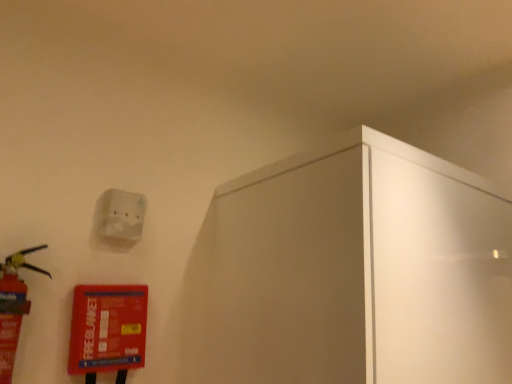
The image size is (512, 384). I want to click on red plastic extinguisher at left, so click(13, 307).

The height and width of the screenshot is (384, 512). Describe the element at coordinates (13, 307) in the screenshot. I see `red plastic extinguisher at left` at that location.

This screenshot has width=512, height=384. I want to click on white matte light switch at upper left, so click(123, 214).

Image resolution: width=512 pixels, height=384 pixels. What do you see at coordinates (123, 214) in the screenshot? I see `white matte light switch at upper left` at bounding box center [123, 214].

Find the location of a particular element. Image resolution: width=512 pixels, height=384 pixels. red plastic extinguisher at left is located at coordinates point(13,307).

Visually, is white matte light switch at upper left positioned to the left or to the right of red plastic extinguisher at left?

white matte light switch at upper left is positioned on red plastic extinguisher at left's right side.

Is the depth of white matte light switch at upper left greater than that of red plastic extinguisher at left?

Yes, white matte light switch at upper left is behind red plastic extinguisher at left.

Which point is more distant from viewer, (x=108, y=233) or (x=18, y=258)?

Point (x=108, y=233)

From the image's perspective, which one is positioned higher, white matte light switch at upper left or red plastic extinguisher at left?

From the image's view, white matte light switch at upper left is above.

From a real-world perspective, which is physically below, white matte light switch at upper left or red plastic extinguisher at left?

red plastic extinguisher at left.

Considering the sizes of white matte light switch at upper left and red plastic extinguisher at left in the image, is white matte light switch at upper left wider or thinner than red plastic extinguisher at left?

Clearly, white matte light switch at upper left has less width compared to red plastic extinguisher at left.

Considering the sizes of objects white matte light switch at upper left and red plastic extinguisher at left in the image provided, who is shorter, white matte light switch at upper left or red plastic extinguisher at left?

white matte light switch at upper left is shorter.

Can you confirm if white matte light switch at upper left is bigger than red plastic extinguisher at left?

Incorrect, white matte light switch at upper left is not larger than red plastic extinguisher at left.

Is white matte light switch at upper left situated inside red plastic extinguisher at left or outside?

white matte light switch at upper left is spatially situated outside red plastic extinguisher at left.

Are white matte light switch at upper left and red plastic extinguisher at left far apart?

No, there isn't a large distance between white matte light switch at upper left and red plastic extinguisher at left.

Is white matte light switch at upper left positioned with its back to red plastic extinguisher at left?

white matte light switch at upper left does not have its back to red plastic extinguisher at left.

How many degrees apart are the facing directions of white matte light switch at upper left and red plastic extinguisher at left?

They differ by 1.39 degrees in their facing directions.

Identify the location of extinguisher located underneath the white matte light switch at upper left (from a real-world perspective). (13, 307).

Can you confirm if red plastic extinguisher at left is positioned to the right of white matte light switch at upper left?

Incorrect, red plastic extinguisher at left is not on the right side of white matte light switch at upper left.

Is the depth of red plastic extinguisher at left greater than that of white matte light switch at upper left?

No, it is not.

Considering the positions of point (8, 333) and point (120, 217), is point (8, 333) closer or farther from the camera than point (120, 217)?

Point (8, 333) is closer to the camera than point (120, 217).

From the image's perspective, is red plastic extinguisher at left positioned above or below white matte light switch at upper left?

From the image's perspective, red plastic extinguisher at left appears below white matte light switch at upper left.

From a real-world perspective, is red plastic extinguisher at left located beneath white matte light switch at upper left?

Yes, from a real-world perspective, red plastic extinguisher at left is below white matte light switch at upper left.

Is red plastic extinguisher at left wider or thinner than white matte light switch at upper left?

red plastic extinguisher at left is wider than white matte light switch at upper left.

Is red plastic extinguisher at left shorter than white matte light switch at upper left?

No.

Which of these two, red plastic extinguisher at left or white matte light switch at upper left, is bigger?

red plastic extinguisher at left.

Is red plastic extinguisher at left situated inside white matte light switch at upper left or outside?

red plastic extinguisher at left is not enclosed by white matte light switch at upper left.

Are red plastic extinguisher at left and white matte light switch at upper left far apart?

red plastic extinguisher at left is actually quite close to white matte light switch at upper left.

Is red plastic extinguisher at left turned away from white matte light switch at upper left?

red plastic extinguisher at left does not have its back to white matte light switch at upper left.

How different are the orientations of red plastic extinguisher at left and white matte light switch at upper left in degrees?

The facing directions of red plastic extinguisher at left and white matte light switch at upper left are 1.39 degrees apart.

Measure the distance from red plastic extinguisher at left to white matte light switch at upper left.

red plastic extinguisher at left and white matte light switch at upper left are 9.36 inches apart.

At what (x,y) coordinates should I click in order to perform the action: click on light switch behind the red plastic extinguisher at left. Please return your answer as a coordinate pair (x, y). Looking at the image, I should click on (123, 214).

Find the location of `light switch above the red plastic extinguisher at left (from the image's perspective)`. light switch above the red plastic extinguisher at left (from the image's perspective) is located at coordinates (123, 214).

Where is `extinguisher below the white matte light switch at upper left (from the image's perspective)`? extinguisher below the white matte light switch at upper left (from the image's perspective) is located at coordinates (13, 307).